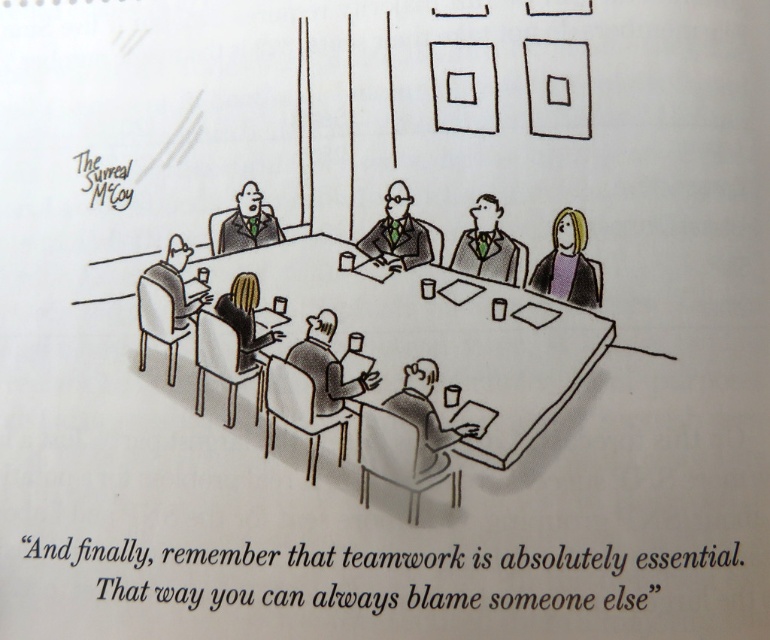
Looking at this image, you are organizing a meeting in this room and need to place a new item on the table. The shiny metallic bottle at center currently occupies space. Can the matte black chair at left be placed on the table without removing the bottle?

The shiny metallic bottle at center is larger in size than the matte black chair at left, so placing the matte black chair at left on the table might be possible if there is enough space not occupied by the bottle. However, since the bottle is already at the center, it may limit the available space depending on the chair size relative to the table dimensions.

In the meeting room scene, there are two objects of interest labeled as black hair at center and matte black chair at left. From the perspective of someone sitting at the table, which object is positioned to the right side?

The black hair at center is positioned to the right of the matte black chair at left, so from the perspective of someone sitting at the table, the black hair at center is to the right.

In the meeting room scene, there are two objects of interest. The first is the black hair at center, and the second is the matte black chair at left. From the perspective of someone sitting at the table, which of these two objects is positioned lower in the image?

The black hair at center is located below the matte black chair at left, so it is positioned lower in the image.